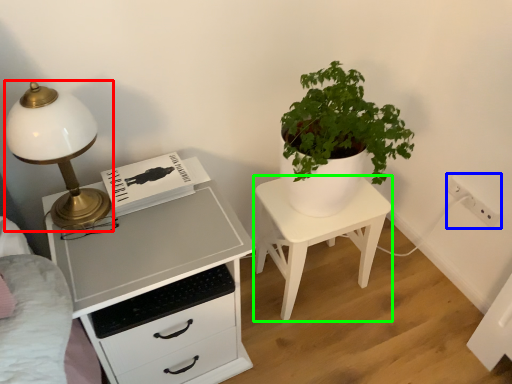
Question: Based on their relative distances, which object is farther from lamp (highlighted by a red box)? Choose from electric outlet (highlighted by a blue box) and nightstand (highlighted by a green box).

Choices:
 (A) electric outlet
 (B) nightstand

Answer: (A)